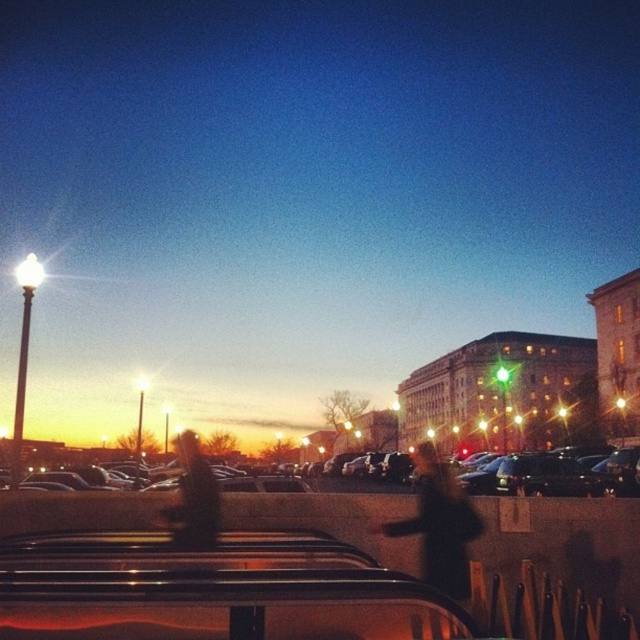
Who is more distant from viewer, (426, 516) or (182, 436)?

The point (182, 436) is more distant.

Which is behind, point (465, 513) or point (188, 472)?

The point (188, 472) is more distant.

Locate an element on the screen. The image size is (640, 640). black matte coat at center is located at coordinates (440, 525).

Is point (547, 496) more distant than point (429, 467)?

No, (547, 496) is in front of (429, 467).

Does point (83, 456) come in front of point (451, 536)?

No, (83, 456) is behind (451, 536).

You are a GUI agent. You are given a task and a screenshot of the screen. Output one action in this format:
    pyautogui.click(x=<x>, y=<y>)
    Task: Click on the metallic gray cars at center
    
    Given the screenshot: What is the action you would take?
    click(x=577, y=476)

The width and height of the screenshot is (640, 640). Describe the element at coordinates (577, 476) in the screenshot. I see `metallic gray cars at center` at that location.

Does metallic gray cars at center appear under dark brown leather jacket at center?

No, metallic gray cars at center is not below dark brown leather jacket at center.

You are a GUI agent. You are given a task and a screenshot of the screen. Output one action in this format:
    pyautogui.click(x=<x>, y=<y>)
    Task: Click on the metallic gray cars at center
    This screenshot has width=640, height=640.
    Given the screenshot: What is the action you would take?
    pyautogui.click(x=577, y=476)

Where is `metallic gray cars at center`? This screenshot has width=640, height=640. metallic gray cars at center is located at coordinates (577, 476).